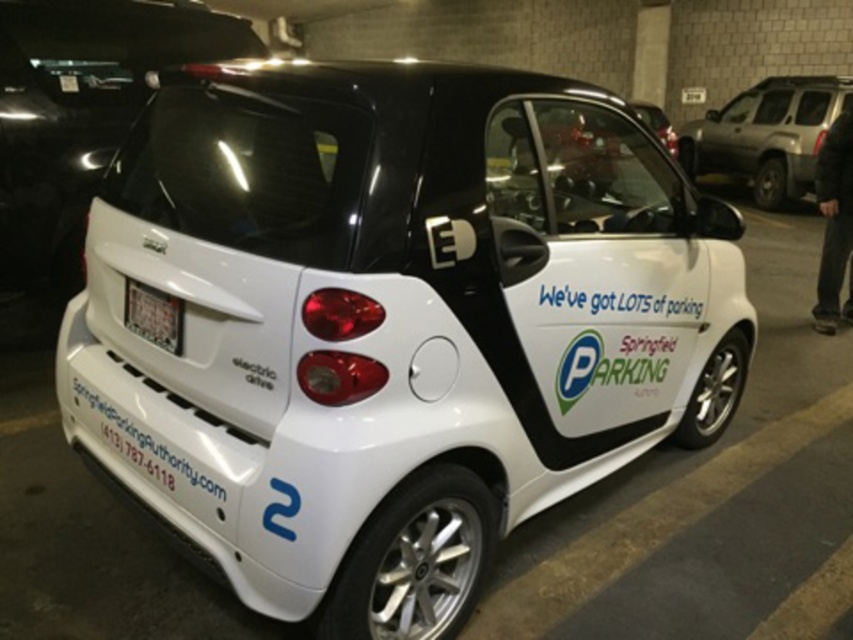
Is matte black suv at upper right smaller than white plastic license plate at rear?

Actually, matte black suv at upper right might be larger than white plastic license plate at rear.

Does matte black suv at upper right have a greater width compared to white plastic license plate at rear?

Yes, matte black suv at upper right is wider than white plastic license plate at rear.

Which is in front, point (746, 116) or point (144, 323)?

Positioned in front is point (144, 323).

Where is `matte black suv at upper right`? The height and width of the screenshot is (640, 853). matte black suv at upper right is located at coordinates (767, 134).

Is white glossy bumper at lower left taller than white plastic license plate at rear?

Indeed, white glossy bumper at lower left has a greater height compared to white plastic license plate at rear.

Which is below, white glossy bumper at lower left or white plastic license plate at rear?

white plastic license plate at rear is lower down.

Is point (152, 40) farther from viewer compared to point (149, 321)?

Yes, point (152, 40) is behind point (149, 321).

The width and height of the screenshot is (853, 640). I want to click on white glossy bumper at lower left, so click(80, 113).

Who is positioned more to the right, white glossy bumper at lower left or matte black suv at upper right?

Positioned to the right is matte black suv at upper right.

Is point (242, 24) farther from viewer compared to point (776, 202)?

That is False.

What are the coordinates of `white glossy bumper at lower left` in the screenshot? It's located at (80, 113).